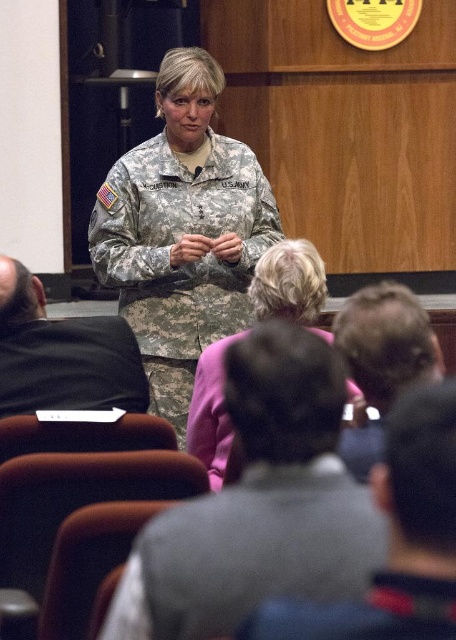
You are an attendee in the conference room and want to move from your current position at point (114,211) to the exit located at point (242,557). Is the path clear for you to walk directly to the exit without any obstacles?

Point (242,557) is in front of point (114,211), so the path is clear for you to walk directly to the exit without any obstacles.

You are a photographer in the room and want to capture both the gray fabric jacket at lower center and the camouflage fabric uniform at center in a single shot. Considering their sizes, which object should you focus on to ensure both are visible without cropping?

The gray fabric jacket at lower center occupies less space than the camouflage fabric uniform at center, so you should focus on the camouflage fabric uniform at center to ensure both are visible in the frame.

You are a tailor who needs to determine which jacket, the gray fabric jacket at lower center or the pink fabric jacket at center, requires more fabric for alterations. Based on the description, which jacket would need more fabric?

The pink fabric jacket at center requires more fabric for alterations because it has a greater height than the gray fabric jacket at lower center.